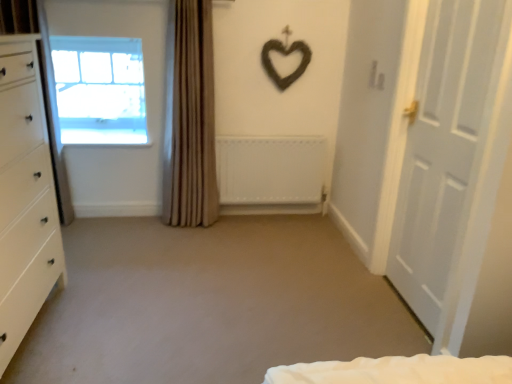
Question: Considering the relative sizes of white matte radiator at center and beige fabric curtain at center in the image provided, is white matte radiator at center smaller than beige fabric curtain at center?

Choices:
 (A) no
 (B) yes

Answer: (B)

Question: Considering the relative sizes of white matte radiator at center and beige fabric curtain at center in the image provided, is white matte radiator at center thinner than beige fabric curtain at center?

Choices:
 (A) no
 (B) yes

Answer: (B)

Question: From the image's perspective, does white matte radiator at center appear higher than beige fabric curtain at center?

Choices:
 (A) yes
 (B) no

Answer: (B)

Question: Can you confirm if white matte radiator at center is wider than beige fabric curtain at center?

Choices:
 (A) yes
 (B) no

Answer: (B)

Question: Is white matte radiator at center at the left side of beige fabric curtain at center?

Choices:
 (A) yes
 (B) no

Answer: (B)

Question: Is white matte radiator at center oriented towards beige fabric curtain at center?

Choices:
 (A) yes
 (B) no

Answer: (B)

Question: Does white matte radiator at center lie behind white matte door at right?

Choices:
 (A) no
 (B) yes

Answer: (B)

Question: Considering the relative sizes of white matte radiator at center and white matte door at right in the image provided, is white matte radiator at center shorter than white matte door at right?

Choices:
 (A) yes
 (B) no

Answer: (A)

Question: From the image's perspective, is white matte radiator at center under white matte door at right?

Choices:
 (A) yes
 (B) no

Answer: (B)

Question: Does white matte radiator at center have a smaller size compared to white matte door at right?

Choices:
 (A) yes
 (B) no

Answer: (A)

Question: Are white matte radiator at center and white matte door at right located far from each other?

Choices:
 (A) yes
 (B) no

Answer: (A)

Question: Is white matte radiator at center not within white matte door at right?

Choices:
 (A) no
 (B) yes

Answer: (B)

Question: Can you confirm if transparent glass window at upper left is thinner than white glossy chest of drawers at left?

Choices:
 (A) yes
 (B) no

Answer: (A)